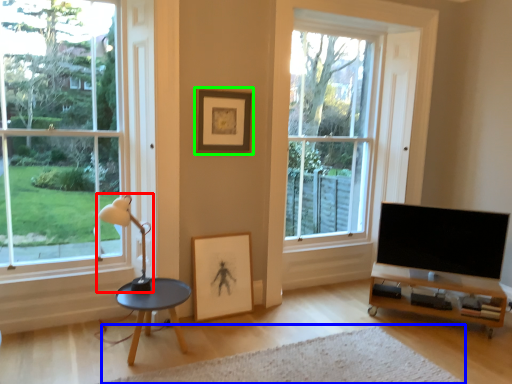
Question: Which is nearer to the lamp (highlighted by a red box)? plain (highlighted by a blue box) or picture frame (highlighted by a green box).

Choices:
 (A) plain
 (B) picture frame

Answer: (B)